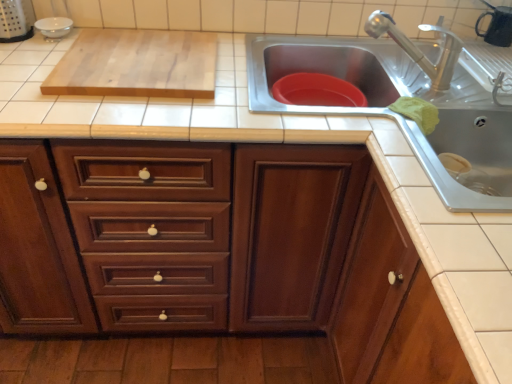
Question: From the image's perspective, is light wood cutting board at upper left above wooden cabinet at center, which is the first cabinetry from left to right?

Choices:
 (A) no
 (B) yes

Answer: (B)

Question: Is light wood cutting board at upper left facing away from wooden cabinet at center, which is the first cabinetry from left to right?

Choices:
 (A) yes
 (B) no

Answer: (B)

Question: Does light wood cutting board at upper left have a lesser width compared to wooden cabinet at center, which is the first cabinetry from left to right?

Choices:
 (A) yes
 (B) no

Answer: (A)

Question: Does light wood cutting board at upper left lie behind wooden cabinet at center, placed as the 2th cabinetry when sorted from right to left?

Choices:
 (A) no
 (B) yes

Answer: (B)

Question: Does light wood cutting board at upper left have a lesser height compared to wooden cabinet at center, placed as the 2th cabinetry when sorted from right to left?

Choices:
 (A) no
 (B) yes

Answer: (B)

Question: Would you say light wood cutting board at upper left is to the left or to the right of stainless steel sink at upper right in the picture?

Choices:
 (A) right
 (B) left

Answer: (B)

Question: From the image's perspective, is light wood cutting board at upper left located above or below stainless steel sink at upper right?

Choices:
 (A) above
 (B) below

Answer: (A)

Question: Looking at their shapes, would you say light wood cutting board at upper left is wider or thinner than stainless steel sink at upper right?

Choices:
 (A) wide
 (B) thin

Answer: (B)

Question: Is light wood cutting board at upper left bigger or smaller than stainless steel sink at upper right?

Choices:
 (A) big
 (B) small

Answer: (B)

Question: Is wooden cabinet at lower right, the 2th cabinetry viewed from the left, in front of or behind light wood cutting board at upper left in the image?

Choices:
 (A) behind
 (B) front

Answer: (B)

Question: From the image's perspective, is wooden cabinet at lower right, which ranks as the 1th cabinetry in right-to-left order, above or below light wood cutting board at upper left?

Choices:
 (A) above
 (B) below

Answer: (B)

Question: Based on their positions, is wooden cabinet at lower right, the 2th cabinetry viewed from the left, located to the left or right of light wood cutting board at upper left?

Choices:
 (A) right
 (B) left

Answer: (A)

Question: Is wooden cabinet at lower right, the 2th cabinetry viewed from the left, spatially inside light wood cutting board at upper left, or outside of it?

Choices:
 (A) outside
 (B) inside

Answer: (A)

Question: From a real-world perspective, is wooden cabinet at center, which is the first cabinetry from left to right, positioned above or below light wood cutting board at upper left?

Choices:
 (A) below
 (B) above

Answer: (A)

Question: In terms of height, does wooden cabinet at center, placed as the 2th cabinetry when sorted from right to left, look taller or shorter compared to light wood cutting board at upper left?

Choices:
 (A) tall
 (B) short

Answer: (A)